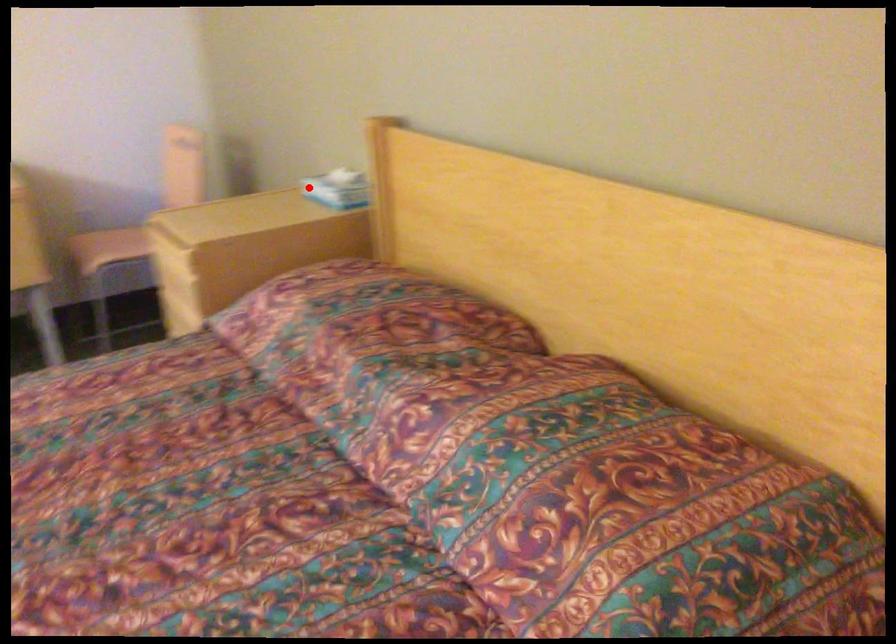
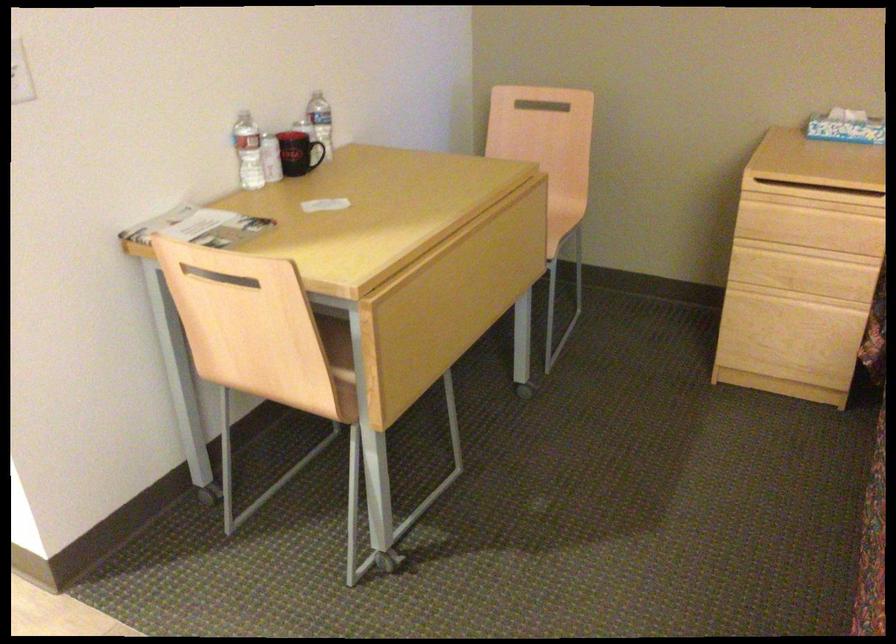
Find the pixel in the second image that matches the highlighted location in the first image.

(846, 127)